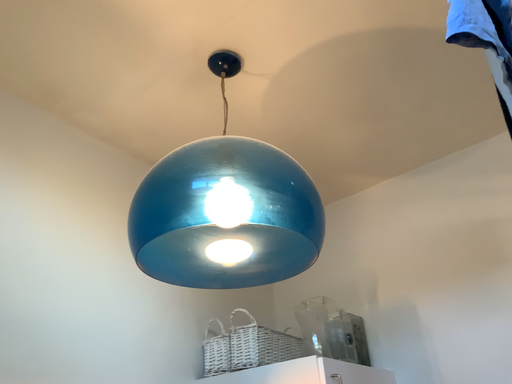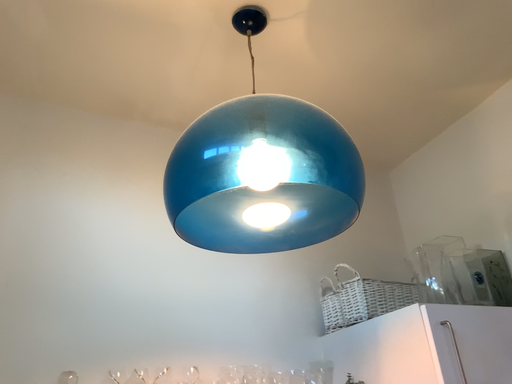
Question: How did the camera likely rotate when shooting the video?

Choices:
 (A) rotated upward
 (B) rotated downward

Answer: (B)